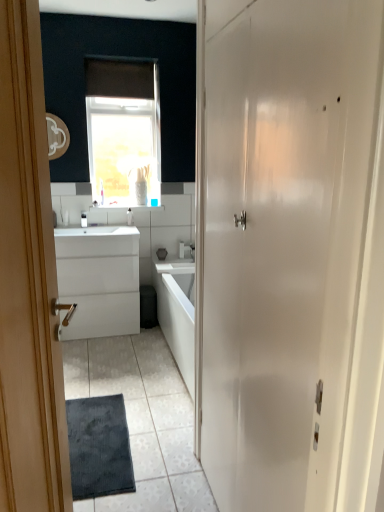
You are a GUI agent. You are given a task and a screenshot of the screen. Output one action in this format:
    pyautogui.click(x=<x>, y=<y>)
    Task: Click on the vacant space to the right of white plastic toothbrush at center, which is the 2th toiletry in right-to-left order
    The height and width of the screenshot is (512, 384).
    Given the screenshot: What is the action you would take?
    pyautogui.click(x=100, y=227)